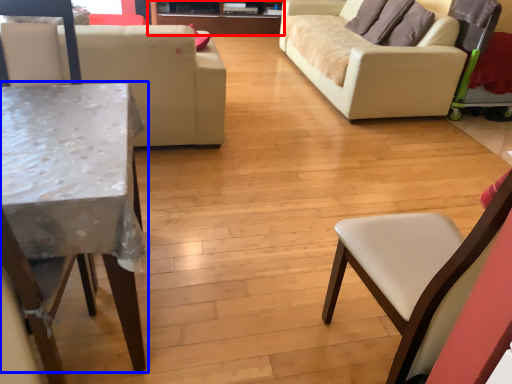
Question: Which object is further to the camera taking this photo, entertainment center (highlighted by a red box) or table (highlighted by a blue box)?

Choices:
 (A) entertainment center
 (B) table

Answer: (A)